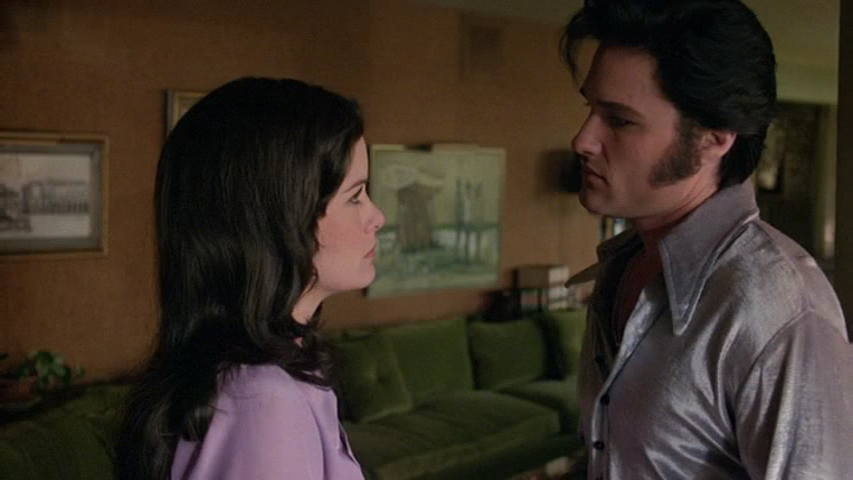
Identify the location of book. This screenshot has height=480, width=853. (553, 276), (555, 295), (556, 306).